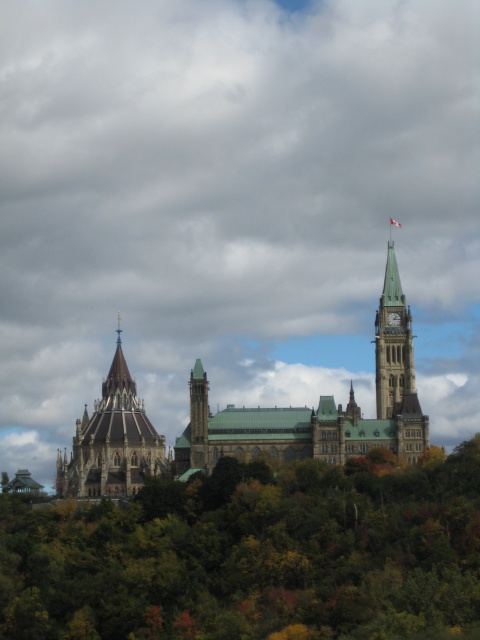
Is brown stone church at center closer to the viewer compared to dark gray stone tower at left?

Yes, brown stone church at center is in front of dark gray stone tower at left.

Can you confirm if brown stone church at center is positioned to the right of dark gray stone tower at left?

Yes, brown stone church at center is to the right of dark gray stone tower at left.

Identify the location of brown stone church at center. (250, 419).

What are the coordinates of `green leafy trees at center` in the screenshot? It's located at (253, 556).

Measure the distance between point (128, 596) and camera.

Point (128, 596) is 501.76 feet away from camera.

This screenshot has width=480, height=640. In order to click on green leafy trees at center in this screenshot , I will do `click(253, 556)`.

Which is in front, point (406, 337) or point (396, 380)?

Positioned in front is point (396, 380).

Is point (197, 456) behind point (385, 387)?

No, (197, 456) is closer to viewer.

Identify the location of brown stone church at center. The width and height of the screenshot is (480, 640). (250, 419).